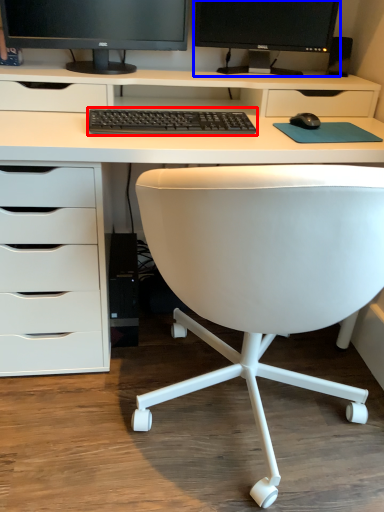
Question: Among these objects, which one is farthest to the camera, computer keyboard (highlighted by a red box) or computer monitor (highlighted by a blue box)?

Choices:
 (A) computer keyboard
 (B) computer monitor

Answer: (B)